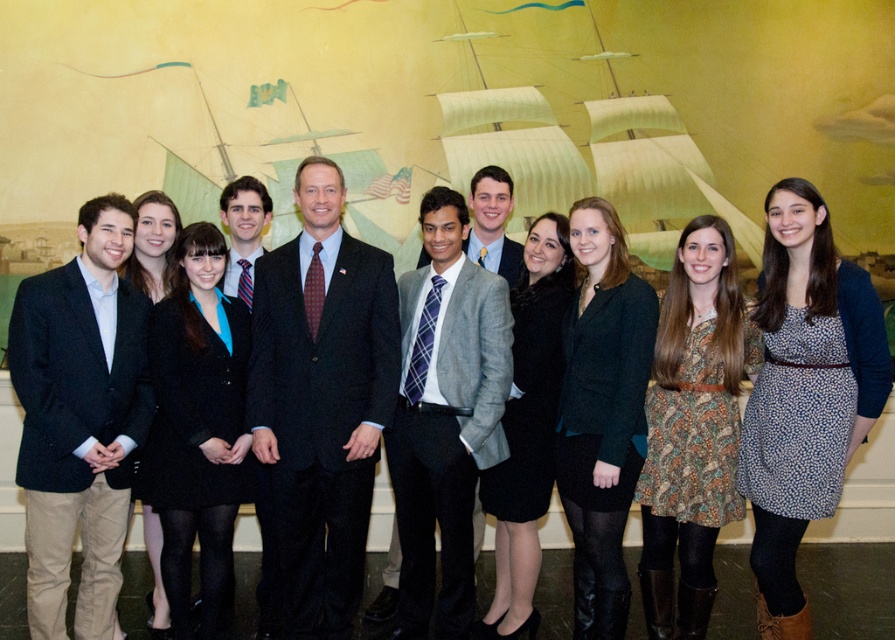
Question: Among these points, which one is farthest from the camera?

Choices:
 (A) (148, 260)
 (B) (246, 195)
 (C) (459, 328)
 (D) (556, 269)

Answer: (B)

Question: Considering the relative positions of printed fabric dress at center and dark green textured blazer at center in the image provided, where is printed fabric dress at center located with respect to dark green textured blazer at center?

Choices:
 (A) right
 (B) left

Answer: (A)

Question: Is gray wool blazer at center below matte black suit at center?

Choices:
 (A) yes
 (B) no

Answer: (A)

Question: Which object appears closest to the camera in this image?

Choices:
 (A) blue dotted dress at center
 (B) dark green textured blazer at center
 (C) black wool coat at center

Answer: (A)

Question: Considering the real-world distances, which object is farthest from the black woolen blazer at center?

Choices:
 (A) blue dotted dress at center
 (B) black wool coat at center
 (C) dark green textured blazer at center

Answer: (A)

Question: Does blue dotted dress at center have a lesser width compared to black woolen blazer at center?

Choices:
 (A) yes
 (B) no

Answer: (B)